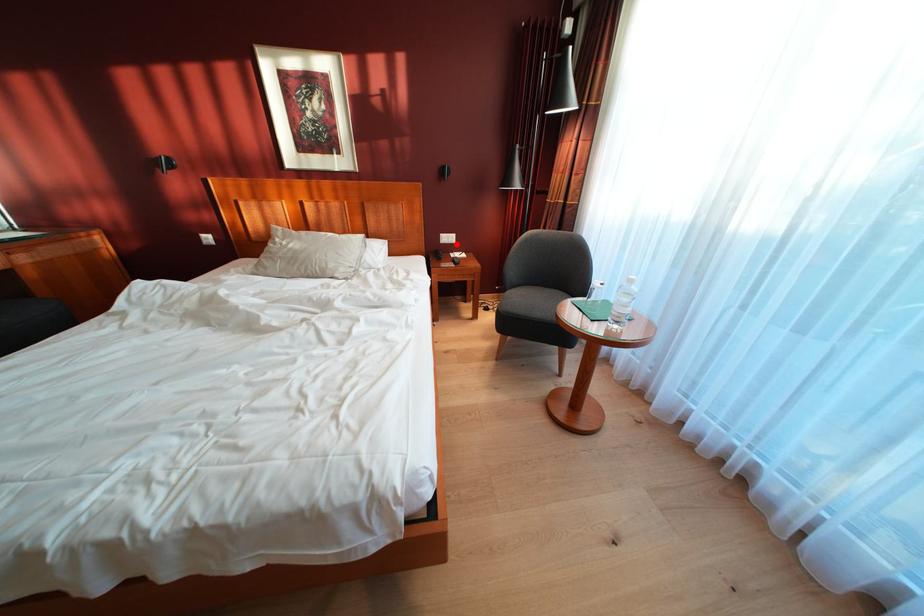
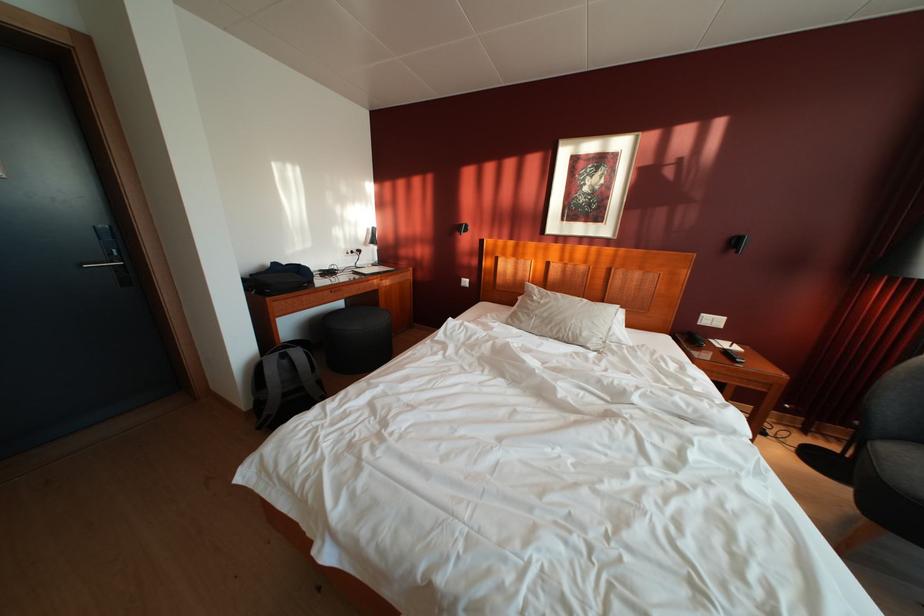
Question: I am providing you with two images of the same scene from different viewpoints. Image1 has a red point marked. In image2, the corresponding 3D location appears at what relative position? Reply with the corresponding letter.

Choices:
 (A) Closer
 (B) Farther

Answer: (B)